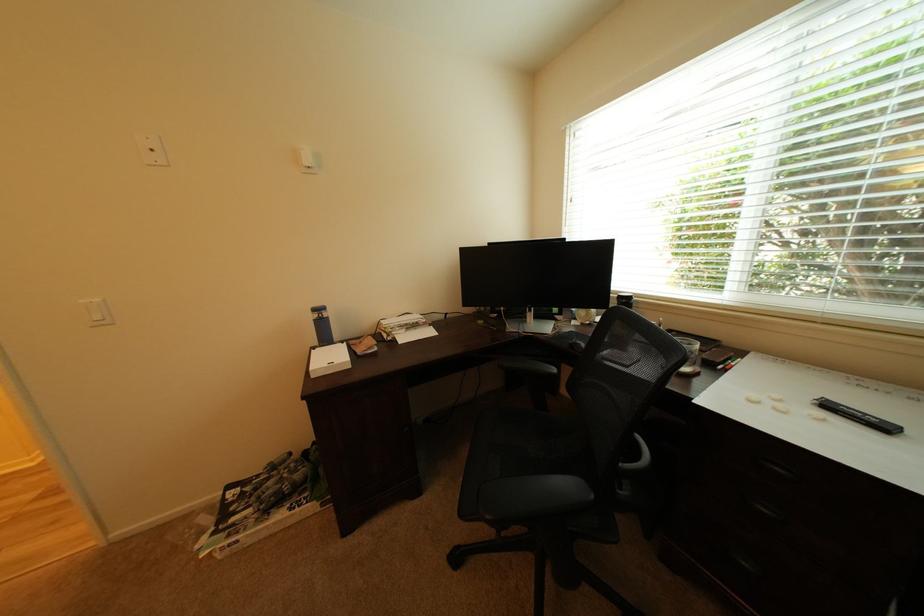
The width and height of the screenshot is (924, 616). What do you see at coordinates (776, 468) in the screenshot?
I see `a dark drawer handle` at bounding box center [776, 468].